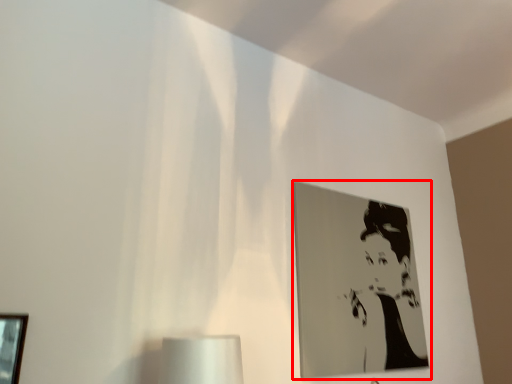
Question: From the image's perspective, where is picture frame (annotated by the red box) located in relation to picture frame in the image?

Choices:
 (A) below
 (B) above

Answer: (B)